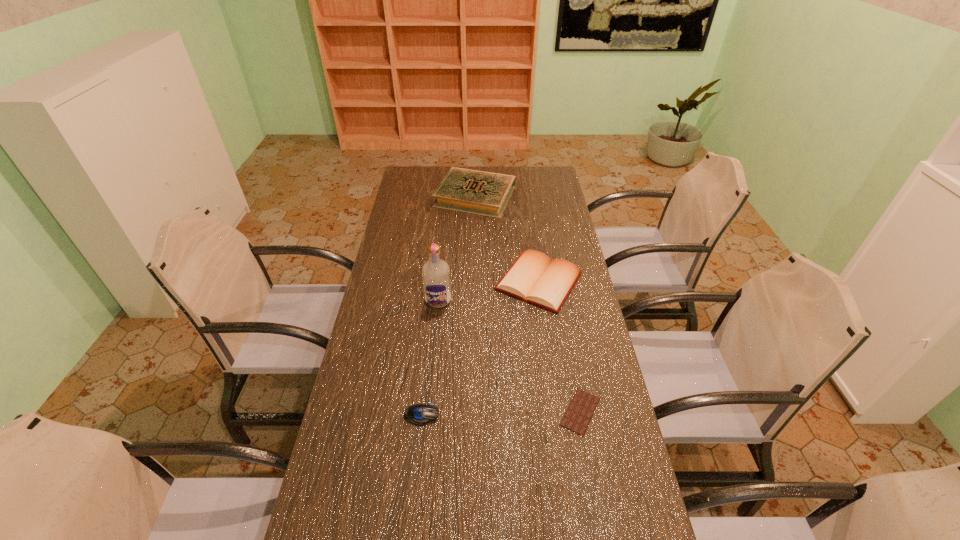
What are the coordinates of `free space between the tallest object and the shortest object` in the screenshot? It's located at (510, 356).

Where is `free space between the second shortest object and the chocolate bar`? The image size is (960, 540). free space between the second shortest object and the chocolate bar is located at coordinates (501, 413).

This screenshot has height=540, width=960. Find the location of `vacant area that lies between the computer mouse and the shortest object`. vacant area that lies between the computer mouse and the shortest object is located at coordinates 501,413.

This screenshot has height=540, width=960. In order to click on free space between the tallest object and the farthest object in this screenshot , I will do `click(457, 248)`.

The height and width of the screenshot is (540, 960). Find the location of `free area in between the second shortest object and the chocolate bar`. free area in between the second shortest object and the chocolate bar is located at coordinates (501, 413).

Where is `free space between the vodka and the third tallest object`? free space between the vodka and the third tallest object is located at coordinates (489, 291).

In order to click on free space between the vodka and the third shortest object in this screenshot , I will do pyautogui.click(x=489, y=291).

Identify which object is the second closest to the shortest object. Please provide its 2D coordinates. Your answer should be formatted as a tuple, i.e. [(x, y)], where the tuple contains the x and y coordinates of a point satisfying the conditions above.

[(418, 414)]

Locate which object ranks third in proximity to the vodka. Please provide its 2D coordinates. Your answer should be formatted as a tuple, i.e. [(x, y)], where the tuple contains the x and y coordinates of a point satisfying the conditions above.

[(581, 409)]

This screenshot has width=960, height=540. I want to click on vacant position in the image that satisfies the following two spatial constraints: 1. on the front side of the hardback book; 2. on the right side of the chocolate bar, so click(471, 411).